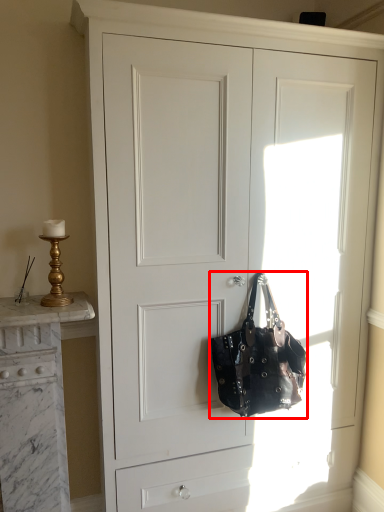
Question: Considering the relative positions of handbag (annotated by the red box) and table lamp in the image provided, where is handbag (annotated by the red box) located with respect to the staircase?

Choices:
 (A) right
 (B) left

Answer: (A)